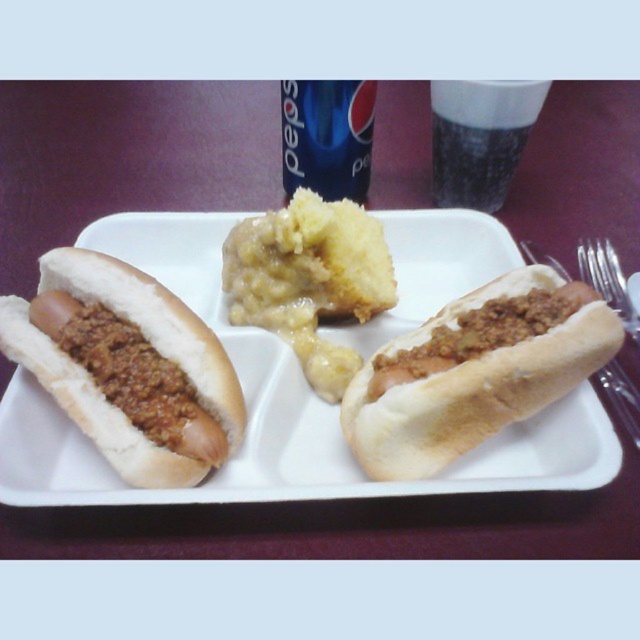
You are a delivery person who needs to place a small package between the brown matte hot dog at left and the blue plastic cup at upper center on the tray. The package is 20 inches long. Will it fit between them without overlapping either object?

The distance between the brown matte hot dog at left and the blue plastic cup at upper center is 23.21 inches. Since the package is 20 inches long, it will fit between them with 3.21 inches of space remaining.

From the picture: You are a photographer taking a picture of the meal. You notice two points on the tray at coordinates point (451, 372) and point (436, 192). Which point will appear larger in the photo?

Point (451, 372) is closer to the camera than point (436, 192), so it will appear larger in the photo.

You are at a picnic and need to decide which item to grab first. The brown matte hot dog at center and the black glass at upper center are both in your line of sight. Which one is taller?

The brown matte hot dog at center is much taller than the black glass at upper center.